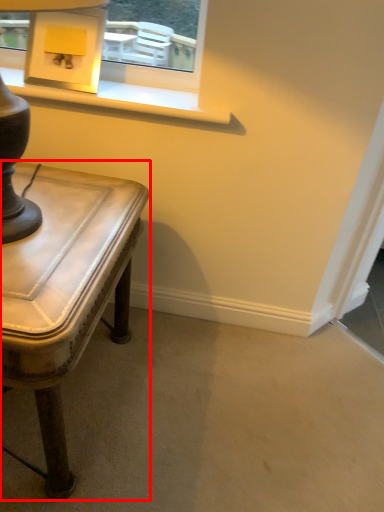
Question: From the image's perspective, what is the correct spatial positioning of table (annotated by the red box) in reference to table lamp?

Choices:
 (A) above
 (B) below

Answer: (B)